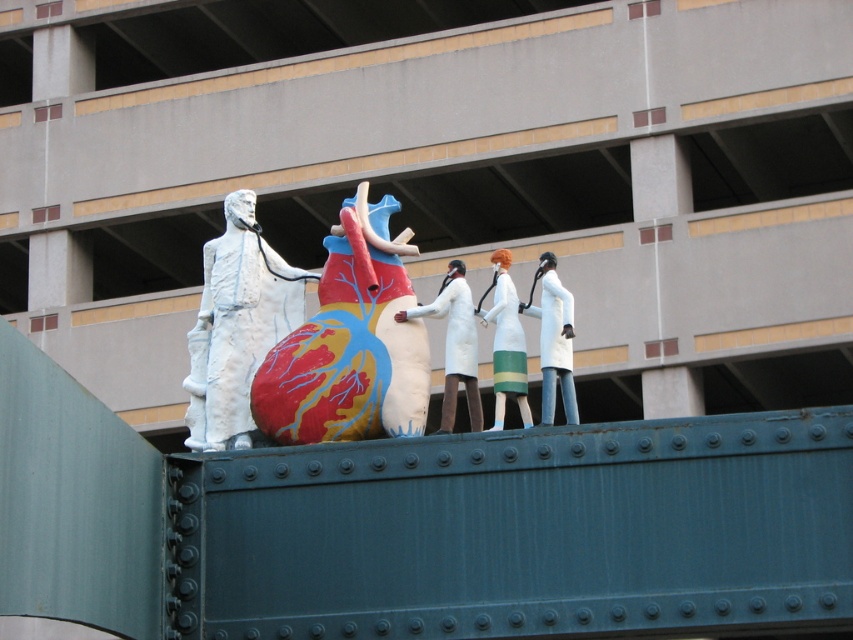
Question: Can you confirm if polychrome painted heart at center is thinner than white matte coat at center?

Choices:
 (A) yes
 (B) no

Answer: (B)

Question: Which of the following is the closest to the observer?

Choices:
 (A) polychrome painted heart at center
 (B) white matte lab coat at center

Answer: (B)

Question: Does polychrome painted heart at center have a larger size compared to white matte lab coat at center?

Choices:
 (A) yes
 (B) no

Answer: (A)

Question: Among these points, which one is farthest from the camera?

Choices:
 (A) (543, 397)
 (B) (491, 426)
 (C) (477, 388)
 (D) (369, 291)

Answer: (D)

Question: Which object is the farthest from the white matte coat at center?

Choices:
 (A) white matte statue at center
 (B) white matte lab coat at center
 (C) white matte dress at center

Answer: (A)

Question: Is polychrome painted heart at center smaller than white matte statue at center?

Choices:
 (A) yes
 (B) no

Answer: (B)